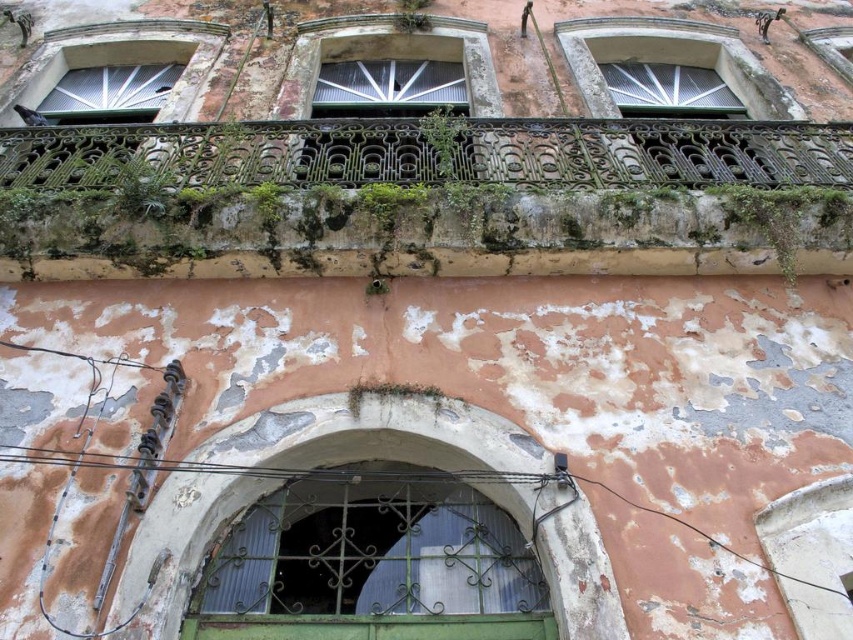
Question: Which point is closer to the camera?

Choices:
 (A) green metal/glass door at center
 (B) green mossy metal railing at upper center
 (C) green wrought iron balcony at upper center

Answer: (A)

Question: Is green mossy metal railing at upper center positioned in front of green metal/glass door at center?

Choices:
 (A) no
 (B) yes

Answer: (A)

Question: Which object is the farthest from the green wrought iron balcony at upper center?

Choices:
 (A) green mossy metal railing at upper center
 (B) green metal/glass door at center

Answer: (B)

Question: Where is green wrought iron balcony at upper center located in relation to green metal/glass door at center in the image?

Choices:
 (A) above
 (B) below

Answer: (A)

Question: Which point is closer to the camera?

Choices:
 (A) (376, 177)
 (B) (215, 602)

Answer: (B)

Question: Can you confirm if green wrought iron balcony at upper center is smaller than green metal/glass door at center?

Choices:
 (A) yes
 (B) no

Answer: (A)